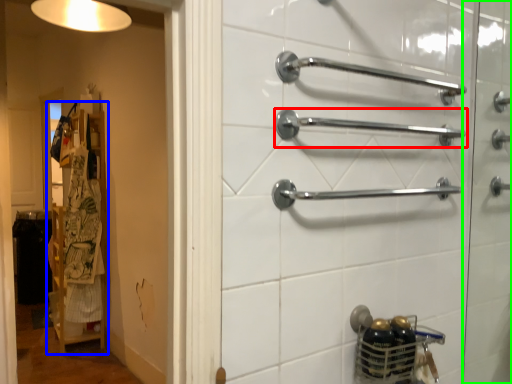
Question: Which object is the farthest from towel rack (highlighted by a red box)? Choose among these: closet (highlighted by a blue box) or screen door (highlighted by a green box).

Choices:
 (A) closet
 (B) screen door

Answer: (A)